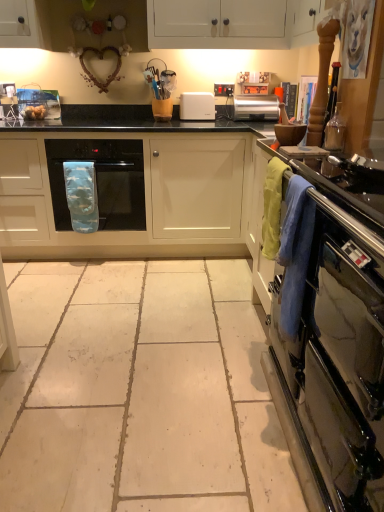
Question: Is golden brown bread at left not inside silver metallic toaster at center?

Choices:
 (A) no
 (B) yes

Answer: (B)

Question: From a real-world perspective, does golden brown bread at left sit lower than silver metallic toaster at center?

Choices:
 (A) yes
 (B) no

Answer: (A)

Question: Considering the relative positions of golden brown bread at left and silver metallic toaster at center in the image provided, is golden brown bread at left behind silver metallic toaster at center?

Choices:
 (A) no
 (B) yes

Answer: (A)

Question: Is golden brown bread at left positioned in front of silver metallic toaster at center?

Choices:
 (A) yes
 (B) no

Answer: (A)

Question: Does golden brown bread at left have a greater height compared to silver metallic toaster at center?

Choices:
 (A) no
 (B) yes

Answer: (A)

Question: Is silver metallic toaster at center to the left or to the right of blue fabric oven mitt at center in the image?

Choices:
 (A) right
 (B) left

Answer: (A)

Question: In terms of width, does silver metallic toaster at center look wider or thinner when compared to blue fabric oven mitt at center?

Choices:
 (A) wide
 (B) thin

Answer: (B)

Question: Is point (236, 104) positioned closer to the camera than point (62, 146)?

Choices:
 (A) farther
 (B) closer

Answer: (A)

Question: Based on their sizes in the image, would you say silver metallic toaster at center is bigger or smaller than blue fabric oven mitt at center?

Choices:
 (A) small
 (B) big

Answer: (A)

Question: Is white plastic toaster at center, the 2th appliance from the right, bigger or smaller than blue fabric oven mitt at center?

Choices:
 (A) small
 (B) big

Answer: (A)

Question: Considering the positions of point (210, 117) and point (109, 167), is point (210, 117) closer or farther from the camera than point (109, 167)?

Choices:
 (A) farther
 (B) closer

Answer: (A)

Question: From the image's perspective, is white plastic toaster at center, which is the 2th appliance from front to back, above or below blue fabric oven mitt at center?

Choices:
 (A) above
 (B) below

Answer: (A)

Question: Considering the relative positions of white plastic toaster at center, positioned as the first appliance in back-to-front order, and blue fabric oven mitt at center in the image provided, is white plastic toaster at center, positioned as the first appliance in back-to-front order, to the left or to the right of blue fabric oven mitt at center?

Choices:
 (A) right
 (B) left

Answer: (A)

Question: From a real-world perspective, is blue fabric oven mitt at center physically located above or below black matte countertop at center?

Choices:
 (A) below
 (B) above

Answer: (B)

Question: Looking at the image, does blue fabric oven mitt at center seem bigger or smaller compared to black matte countertop at center?

Choices:
 (A) big
 (B) small

Answer: (B)